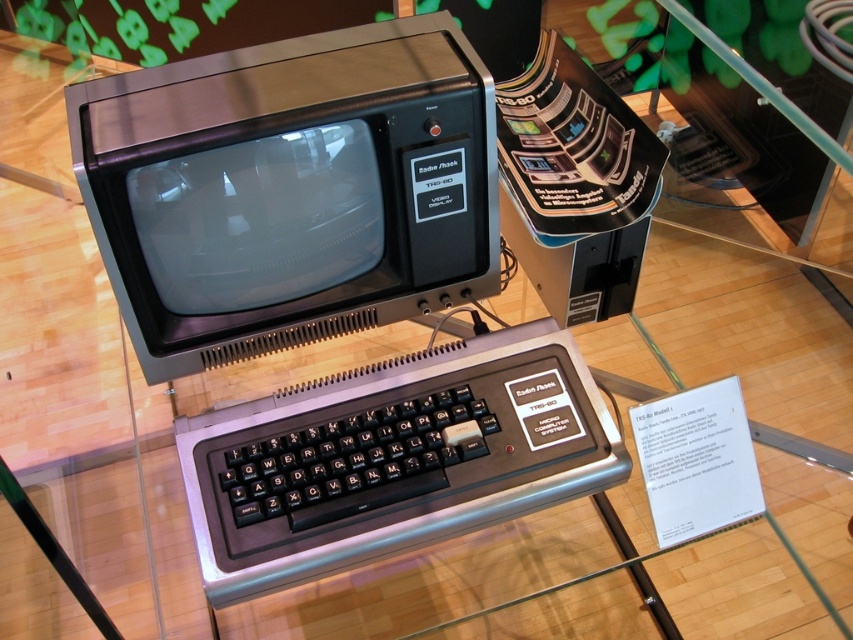
Question: Which of the following is the farthest from the observer?

Choices:
 (A) (140, 268)
 (B) (486, 490)

Answer: (A)

Question: Does matte black monitor at center have a greater width compared to black plastic keyboard at center?

Choices:
 (A) yes
 (B) no

Answer: (B)

Question: Which object is closer to the camera taking this photo?

Choices:
 (A) matte black monitor at center
 (B) black plastic keyboard at center

Answer: (A)

Question: Is matte black monitor at center below black plastic keyboard at center?

Choices:
 (A) no
 (B) yes

Answer: (A)

Question: Is matte black monitor at center closer to camera compared to black plastic keyboard at center?

Choices:
 (A) yes
 (B) no

Answer: (A)